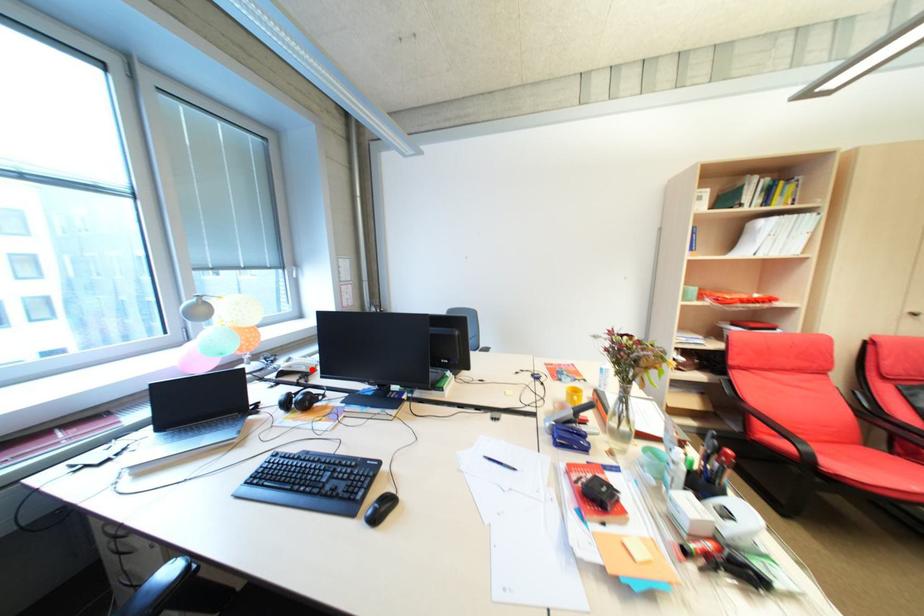
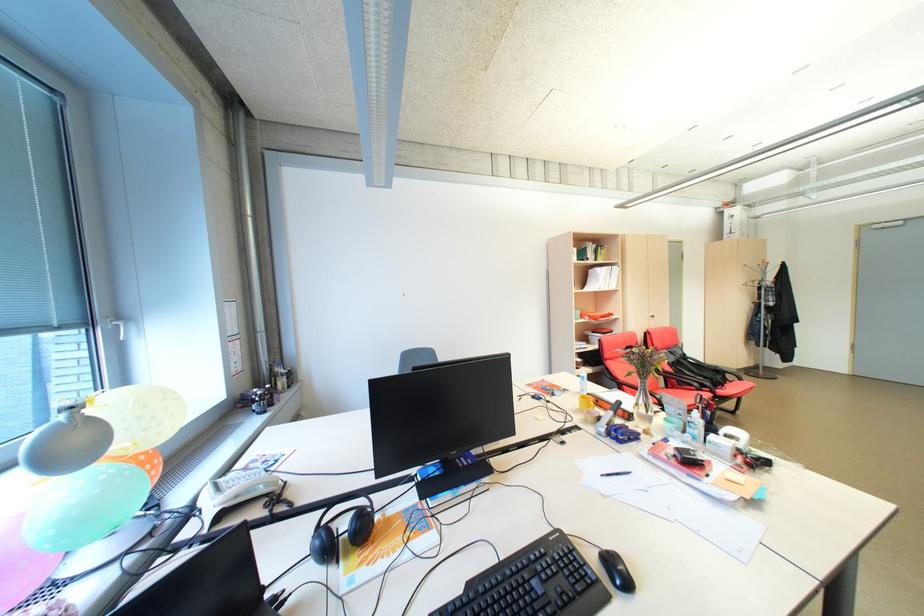
Where in the second image is the point corresponding to the highlighted location from the first image?

(271, 490)